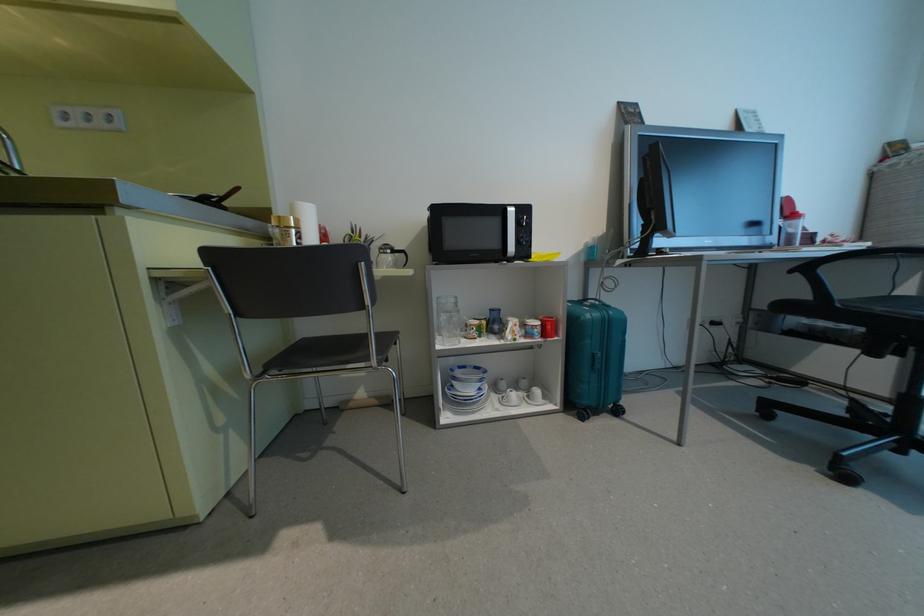
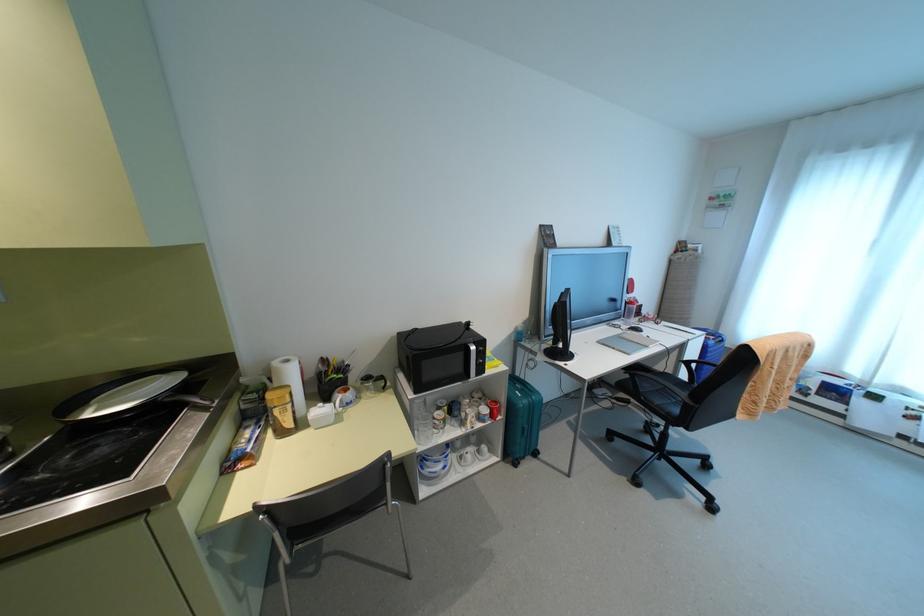
In the second image, find the point that corresponds to the point at 503,397 in the first image.

(459, 456)